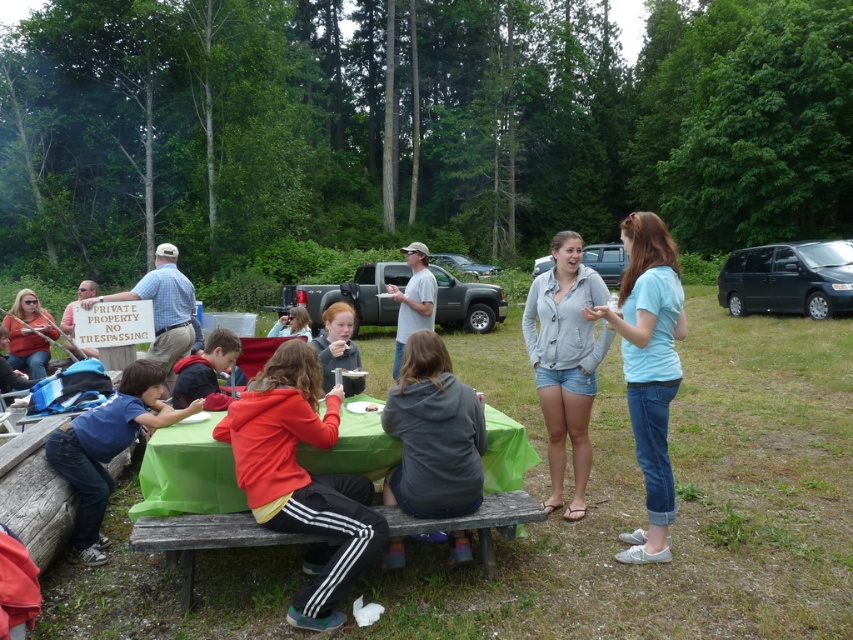
You are at a picnic table and want to hand a sandwich to the white cotton shirt at center and the matte orange hoodie at left. Which person will you need to reach over to give the sandwich to first?

The white cotton shirt at center is in front of the matte orange hoodie at left, so you would need to reach over the matte orange hoodie at left to give the sandwich to the white cotton shirt at center first.